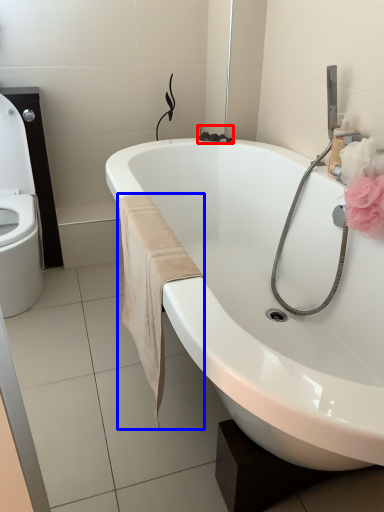
Question: Which of the following is the farthest to the observer, plumbing fixture (highlighted by a red box) or bath towel (highlighted by a blue box)?

Choices:
 (A) plumbing fixture
 (B) bath towel

Answer: (A)